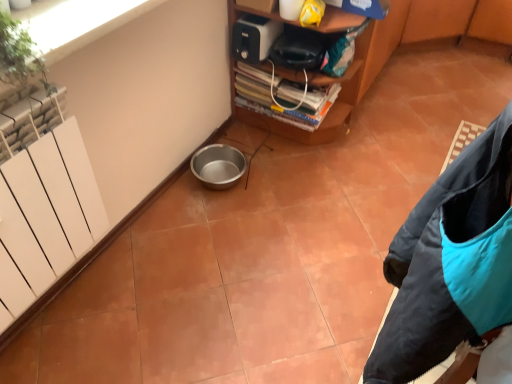
Question: Is metallic silver bowl at lower left taller or shorter than teal synthetic jacket at lower right?

Choices:
 (A) short
 (B) tall

Answer: (A)

Question: In terms of width, does metallic silver bowl at lower left look wider or thinner when compared to teal synthetic jacket at lower right?

Choices:
 (A) wide
 (B) thin

Answer: (A)

Question: Which is nearer to the white matte radiator at left?

Choices:
 (A) metallic silver bowl at lower left
 (B) white plastic toaster at upper center
 (C) teal synthetic jacket at lower right
 (D) green leafy plant at upper left

Answer: (D)

Question: Estimate the real-world distances between objects in this image. Which object is closer to the green leafy plant at upper left?

Choices:
 (A) white plastic toaster at upper center
 (B) white matte radiator at left
 (C) teal synthetic jacket at lower right
 (D) metallic silver bowl at lower left

Answer: (B)